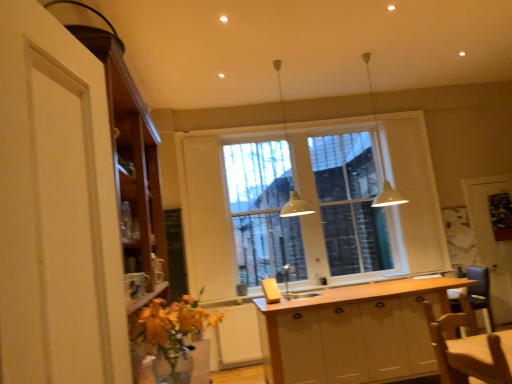
Locate an element on the screen. The width and height of the screenshot is (512, 384). free space above white matte pendant light at center, acting as the 2th light fixture starting from the right (from a real-world perspective) is located at coordinates (274, 64).